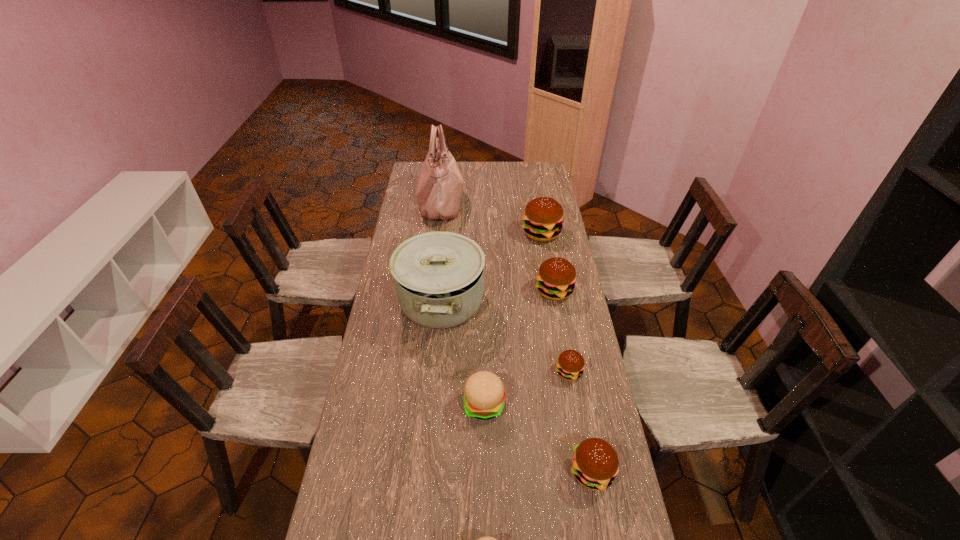
The width and height of the screenshot is (960, 540). Identify the location of the farther beige hamburger. (484, 393).

Image resolution: width=960 pixels, height=540 pixels. What are the coordinates of `the third farthest hamburger` in the screenshot? It's located at (570, 364).

I want to click on the smallest brown hamburger, so click(x=570, y=364).

Where is `free space located 0.130m at the front of the handbag with handles`? free space located 0.130m at the front of the handbag with handles is located at coordinates (491, 203).

Image resolution: width=960 pixels, height=540 pixels. Identify the location of free region located on the front of the second tallest object. pyautogui.click(x=435, y=367).

Locate an element on the screen. Image resolution: width=960 pixels, height=540 pixels. vacant space located on the back of the farthest brown hamburger is located at coordinates (538, 210).

The height and width of the screenshot is (540, 960). Identify the location of vacant space located on the left of the third smallest brown hamburger. (479, 291).

Image resolution: width=960 pixels, height=540 pixels. What are the coordinates of `vacant space situated on the left of the fifth farthest hamburger` in the screenshot? It's located at (512, 471).

Locate an element on the screen. This screenshot has height=540, width=960. blank space located on the left of the third nearest hamburger is located at coordinates (394, 404).

Locate an element on the screen. The width and height of the screenshot is (960, 540). vacant point located 0.140m on the left of the smallest brown hamburger is located at coordinates (513, 372).